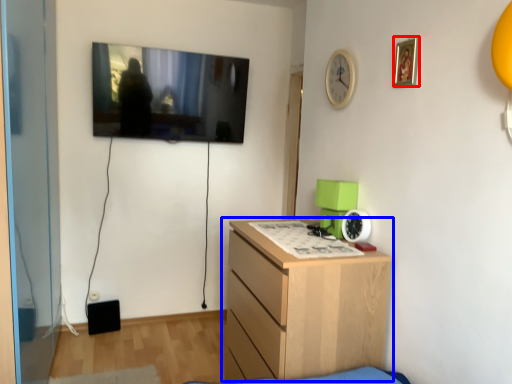
Question: Which point is further to the camera, picture frame (highlighted by a red box) or chest of drawers (highlighted by a blue box)?

Choices:
 (A) picture frame
 (B) chest of drawers

Answer: (B)